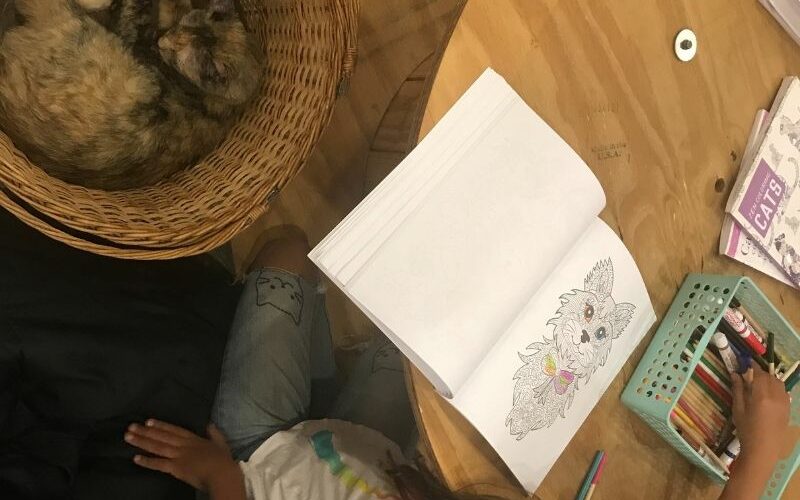
Find the location of a particular element. green plastic pens and pencil basket is located at coordinates 640,401.